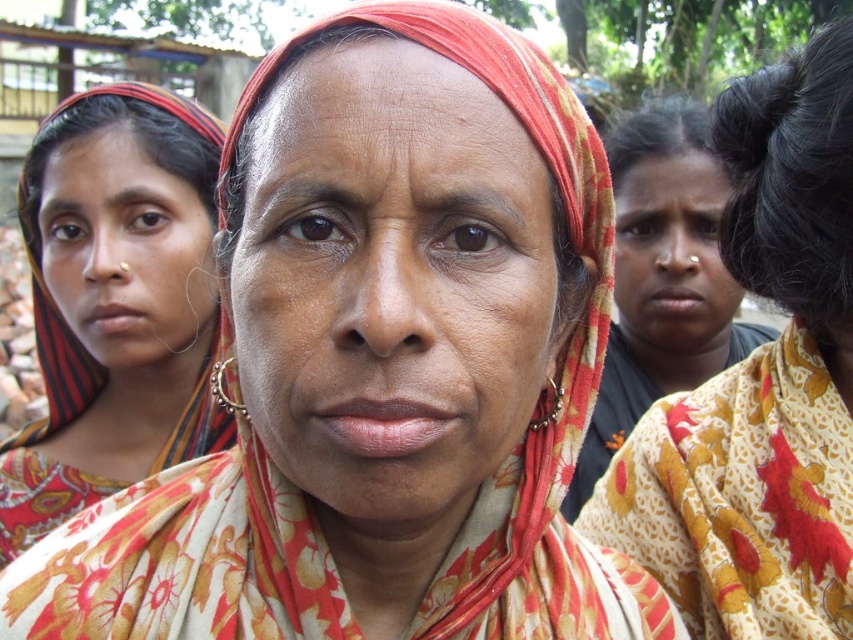
Is matte floral scarf at center taller than matte black saree at left?

No.

Describe the element at coordinates (392, 282) in the screenshot. The height and width of the screenshot is (640, 853). I see `matte floral scarf at center` at that location.

Find the location of a particular element. Image resolution: width=853 pixels, height=640 pixels. matte floral scarf at center is located at coordinates (392, 282).

Consider the image. Who is more distant from viewer, (670, 272) or (270, 88)?

The point (670, 272) is behind.

Measure the distance between matte skin face at center and camera.

They are 1.59 meters apart.

Between point (677, 317) and point (448, 60), which one is positioned behind?

Positioned behind is point (677, 317).

The width and height of the screenshot is (853, 640). Find the location of `matte skin face at center`. matte skin face at center is located at coordinates (672, 257).

Is point (291, 188) closer to camera compared to point (643, 435)?

That is True.

From the picture: Does matte floral scarf at center have a lesser width compared to floral fabric scarf at center?

Yes.

What do you see at coordinates (392, 282) in the screenshot?
I see `matte floral scarf at center` at bounding box center [392, 282].

Where is `matte floral scarf at center`? matte floral scarf at center is located at coordinates tap(392, 282).